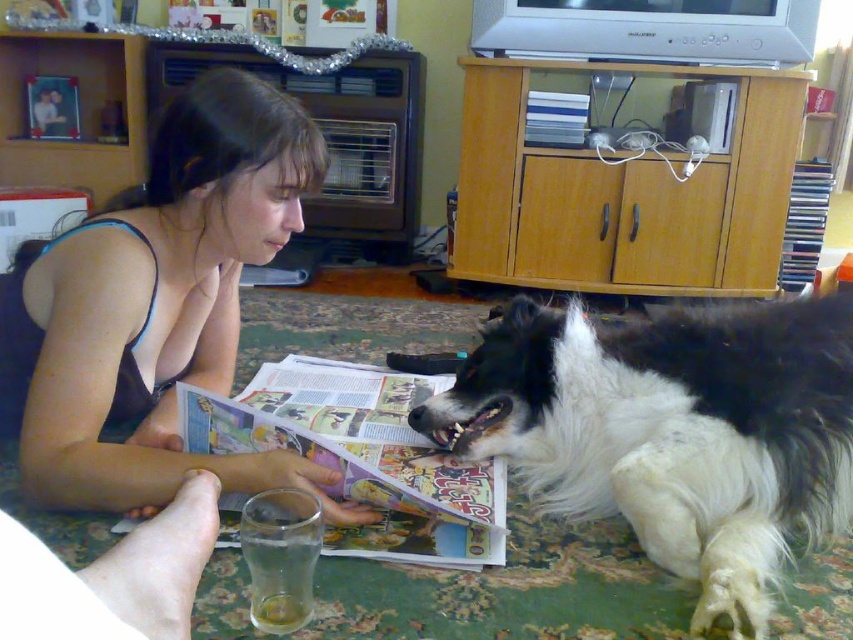
Between point (177, 234) and point (549, 109), which one is positioned behind?

Point (549, 109)

Which is below, matte black tank top at upper left or hardcover book at upper center?

matte black tank top at upper left

Looking at this image, who is more distant from viewer, (57, 371) or (561, 104)?

The point (561, 104) is behind.

Locate an element on the screen. matte black tank top at upper left is located at coordinates (157, 301).

Who is more forward, (x=637, y=531) or (x=440, y=563)?

Point (x=440, y=563) is in front.

Measure the distance between point (740,596) and camera.

Point (740,596) and camera are 38.15 inches apart from each other.

Locate an element on the screen. black and white fur at lower right is located at coordinates (671, 432).

Locate an element on the screen. This screenshot has height=640, width=853. black and white fur at lower right is located at coordinates (671, 432).

Can you confirm if black and white fur at lower right is taller than matte black tank top at upper left?

Incorrect, black and white fur at lower right's height is not larger of matte black tank top at upper left's.

Does point (820, 508) come closer to viewer compared to point (221, 177)?

Yes, point (820, 508) is closer to viewer.

Is point (645, 356) closer to camera compared to point (260, 109)?

No, (645, 356) is further to viewer.

Where is `black and white fur at lower right`? black and white fur at lower right is located at coordinates click(x=671, y=432).